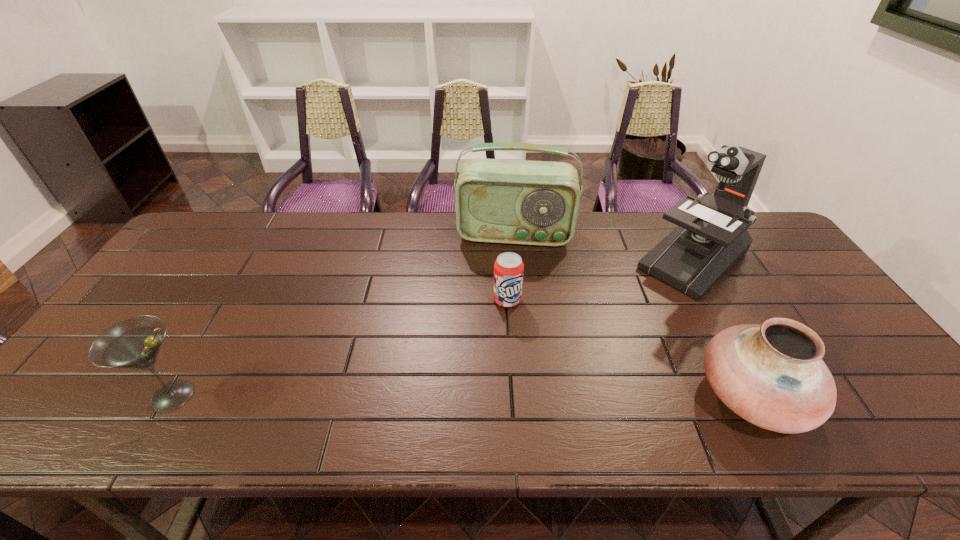
Find the location of a particular element. The image size is (960, 540). empty space between the soda can and the leftmost object is located at coordinates (340, 348).

In order to click on free area in between the microscope and the pottery in this screenshot , I will do `click(723, 328)`.

Find the location of a particular element. This screenshot has height=540, width=960. empty space between the tallest object and the shortest object is located at coordinates (600, 280).

Find the location of a particular element. Image resolution: width=960 pixels, height=540 pixels. unoccupied position between the soda can and the microscope is located at coordinates (600, 280).

Choose which object is the fourth nearest neighbor to the martini. Please provide its 2D coordinates. Your answer should be formatted as a tuple, i.e. [(x, y)], where the tuple contains the x and y coordinates of a point satisfying the conditions above.

[(711, 237)]

Locate an element on the screen. The width and height of the screenshot is (960, 540). object that stands as the closest to the pottery is located at coordinates (711, 237).

Where is `free space in the image that satisfies the following two spatial constraints: 1. on the front side of the fourth shortest object; 2. on the left side of the pottery`? This screenshot has height=540, width=960. free space in the image that satisfies the following two spatial constraints: 1. on the front side of the fourth shortest object; 2. on the left side of the pottery is located at coordinates (530, 395).

The width and height of the screenshot is (960, 540). In order to click on vacant space that satisfies the following two spatial constraints: 1. on the back side of the pottery; 2. on the left side of the microscope in this screenshot , I will do `click(682, 260)`.

Where is `free space that satisfies the following two spatial constraints: 1. on the back side of the leftmost object; 2. on the left side of the tallest object`? free space that satisfies the following two spatial constraints: 1. on the back side of the leftmost object; 2. on the left side of the tallest object is located at coordinates (253, 260).

This screenshot has width=960, height=540. What are the coordinates of `vacant space that satisfies the following two spatial constraints: 1. on the back side of the leftmost object; 2. on the right side of the radio receiver` in the screenshot? It's located at (269, 234).